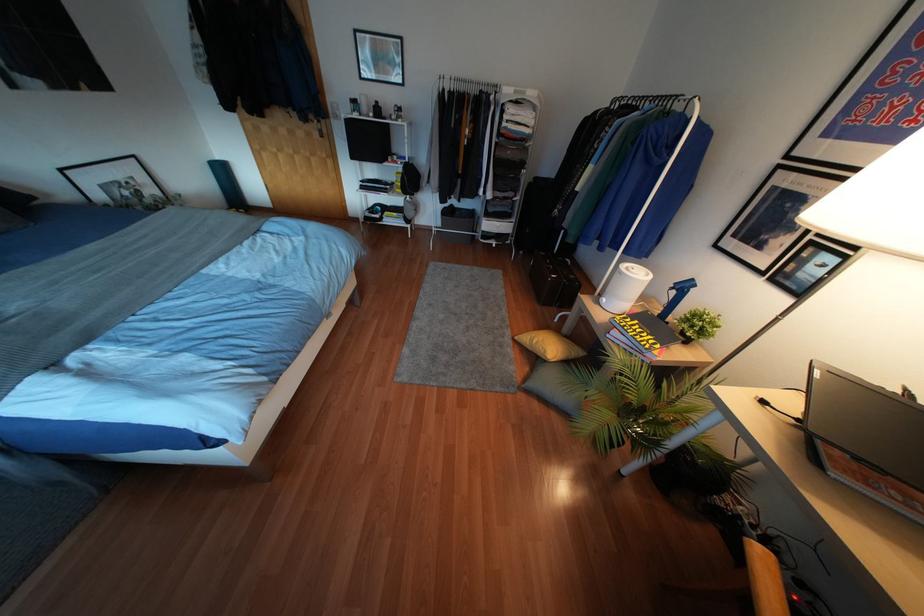
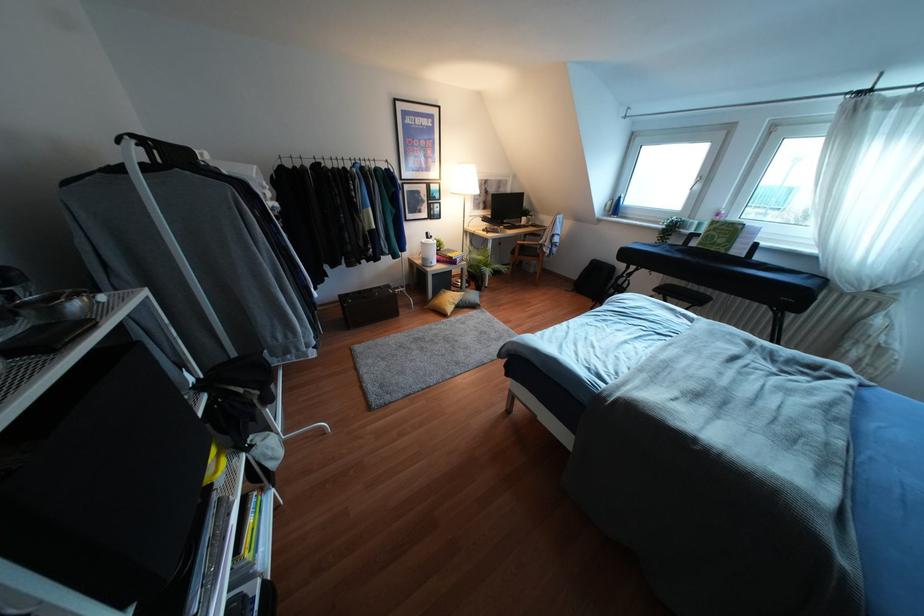
Locate, in the second image, the point that corresponds to the point at 690,280 in the first image.

(427, 233)